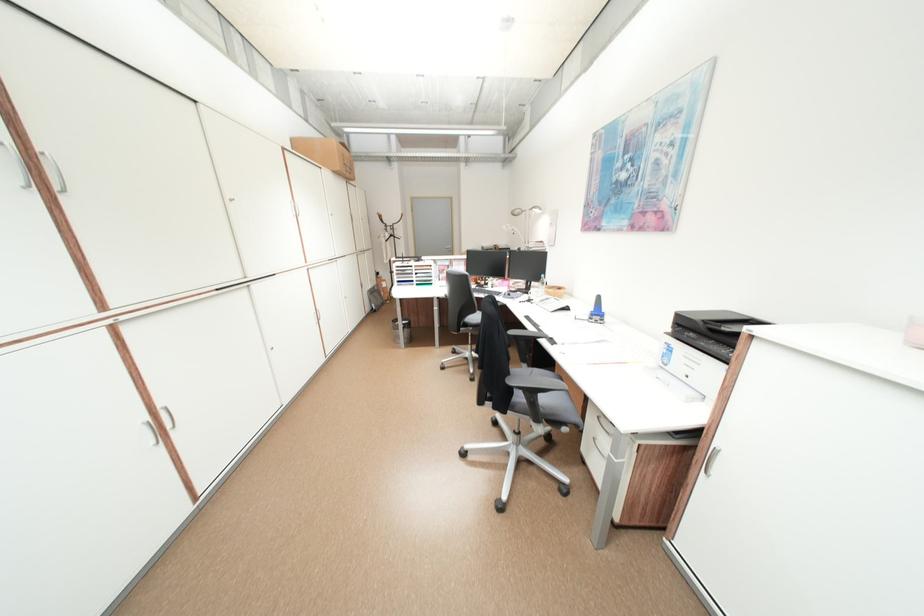
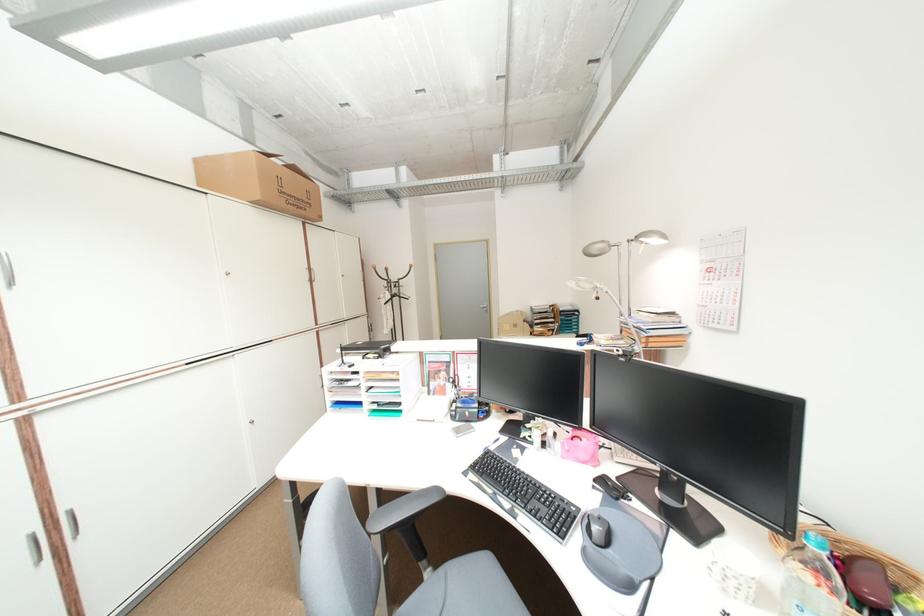
The point at (346, 174) is marked in the first image. Where is the corresponding point in the second image?

(270, 205)